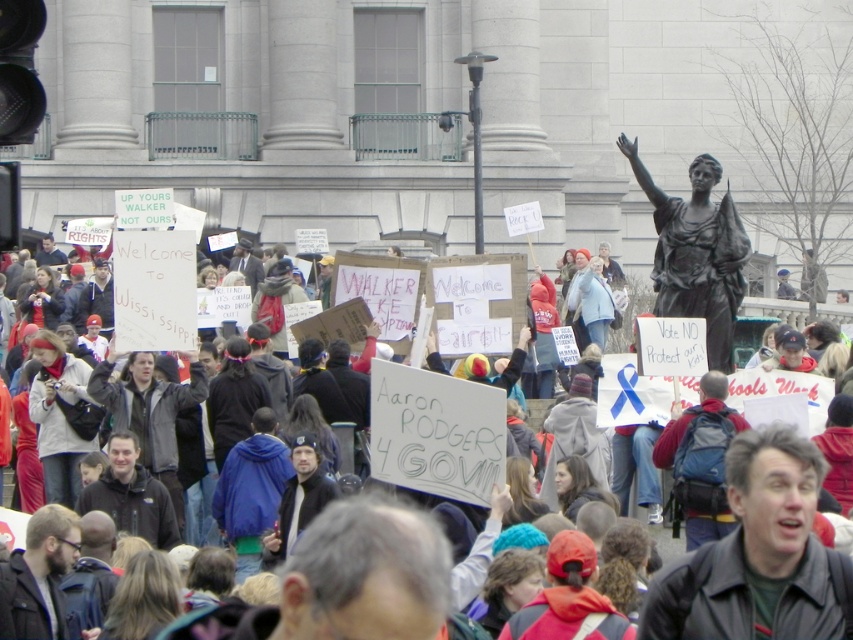
You are a photographer at the protest and want to capture the white cardboard sign at center in your photo. What coordinates should you aim for to ensure the sign is centered?

The white cardboard sign at center is located at coordinates point (788, 531), so aim your camera there to center it.

You are a photographer at this protest. You want to take a photo of the white cardboard sign at center without the black leather jacket at lower right blocking it. What should you do?

The white cardboard sign at center is behind the black leather jacket at lower right, so to avoid the jacket blocking the sign, you should move your position to get a better angle or ask people to shift slightly so the sign becomes visible.